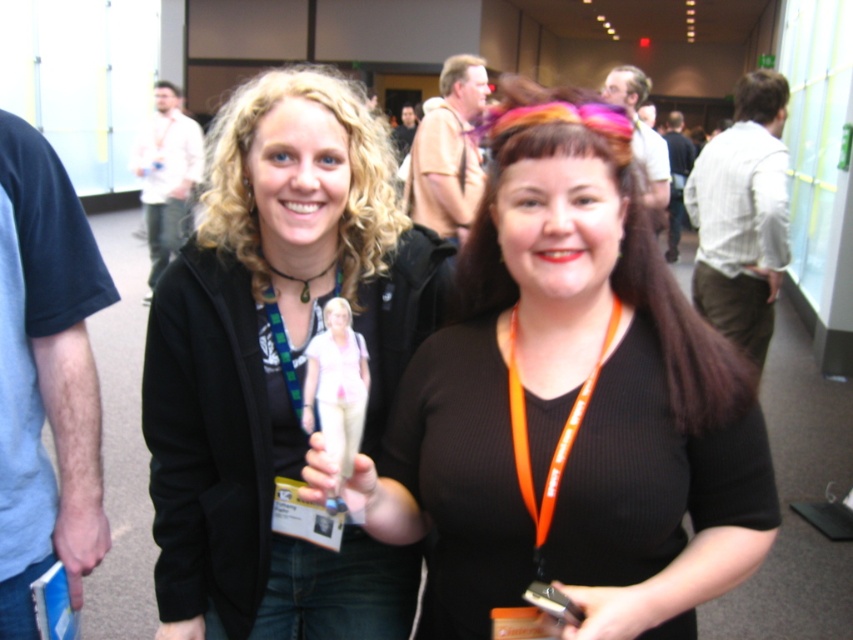
Question: Does black matte shirt at center lie in front of matte black jacket at center?

Choices:
 (A) yes
 (B) no

Answer: (A)

Question: Can you confirm if matte black jacket at center is wider than green fabric lanyard at center?

Choices:
 (A) yes
 (B) no

Answer: (A)

Question: Based on their relative distances, which object is nearer to the black matte shirt at center?

Choices:
 (A) green fabric lanyard at center
 (B) matte black jacket at center

Answer: (B)

Question: Which point is closer to the camera?

Choices:
 (A) (300, 403)
 (B) (231, 307)
 (C) (543, 129)

Answer: (C)

Question: Considering the real-world distances, which object is farthest from the black matte shirt at center?

Choices:
 (A) matte black jacket at center
 (B) green fabric lanyard at center

Answer: (B)

Question: Can you confirm if matte black jacket at center is positioned to the left of green fabric lanyard at center?

Choices:
 (A) no
 (B) yes

Answer: (B)